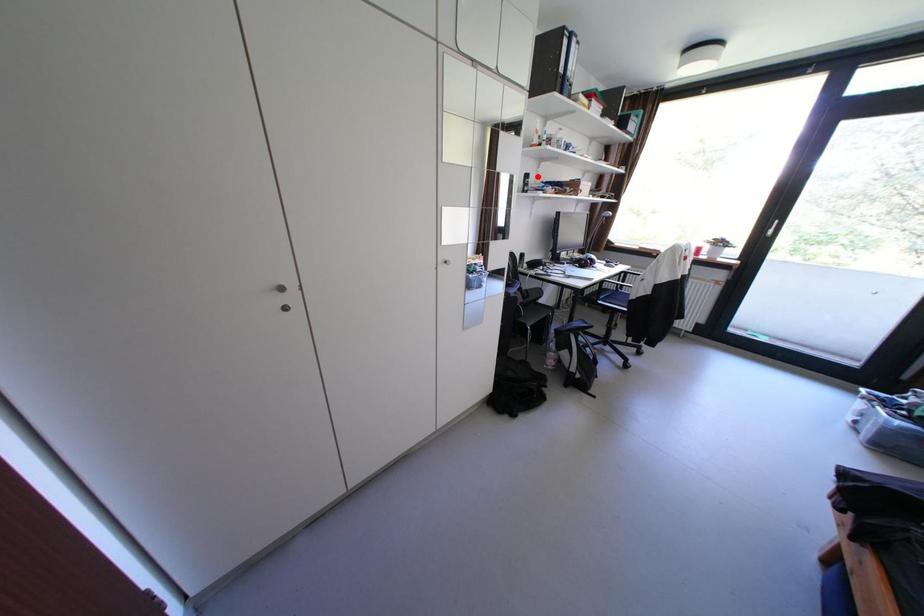
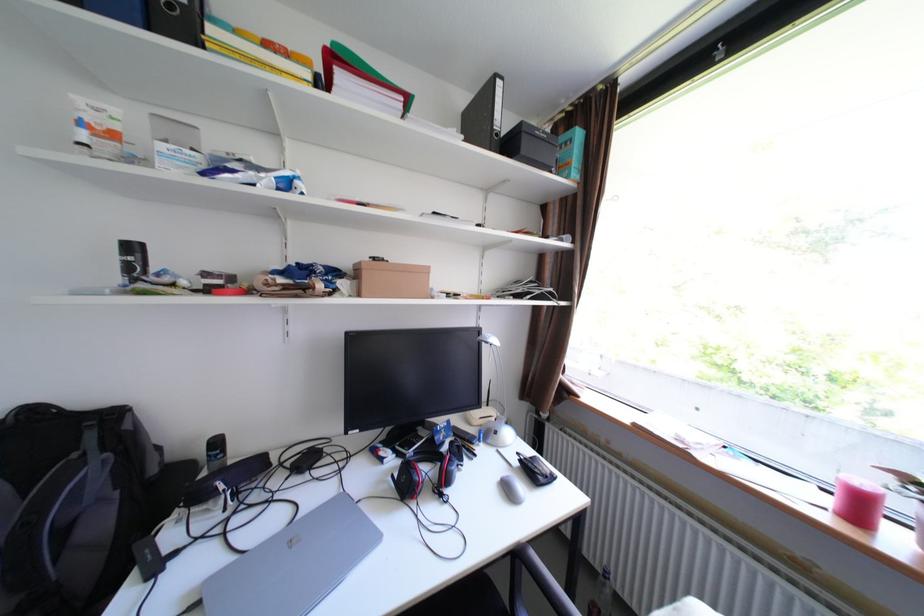
Where in the second image is the point corresponding to the highlighted location from the first image?

(143, 248)